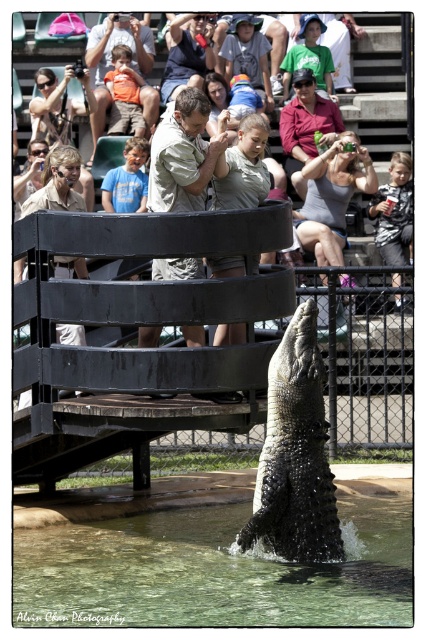
Can you confirm if light brown textured shirt at center is smaller than light brown leather jacket at upper center?

No, light brown textured shirt at center is not smaller than light brown leather jacket at upper center.

Is point (204, 161) behind point (196, 68)?

That is False.

Between point (166, 188) and point (215, 20), which one is positioned behind?

Positioned behind is point (215, 20).

At what (x,y) coordinates should I click in order to perform the action: click on light brown textured shirt at center. Please return your answer as a coordinate pair (x, y). Looking at the image, I should click on (183, 156).

Can you confirm if clear water at lower center is wider than matte khaki shirt at upper left?

Indeed, clear water at lower center has a greater width compared to matte khaki shirt at upper left.

Does clear water at lower center have a larger size compared to matte khaki shirt at upper left?

No.

At what (x,y) coordinates should I click in order to perform the action: click on clear water at lower center. Please return your answer as a coordinate pair (x, y). This screenshot has height=640, width=426. Looking at the image, I should click on (213, 570).

What do you see at coordinates (183, 156) in the screenshot?
I see `light brown textured shirt at center` at bounding box center [183, 156].

Where is `light brown textured shirt at center`? The image size is (426, 640). light brown textured shirt at center is located at coordinates (183, 156).